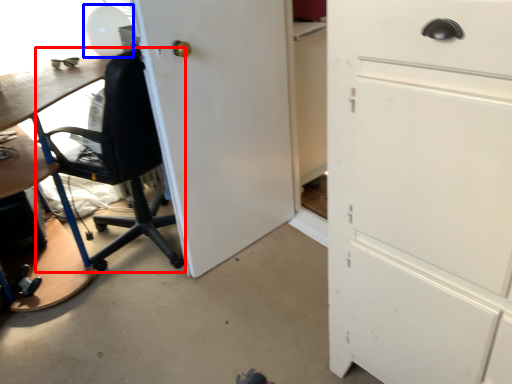
Question: Which point is closer to the camera, chair (highlighted by a red box) or table lamp (highlighted by a blue box)?

Choices:
 (A) chair
 (B) table lamp

Answer: (A)